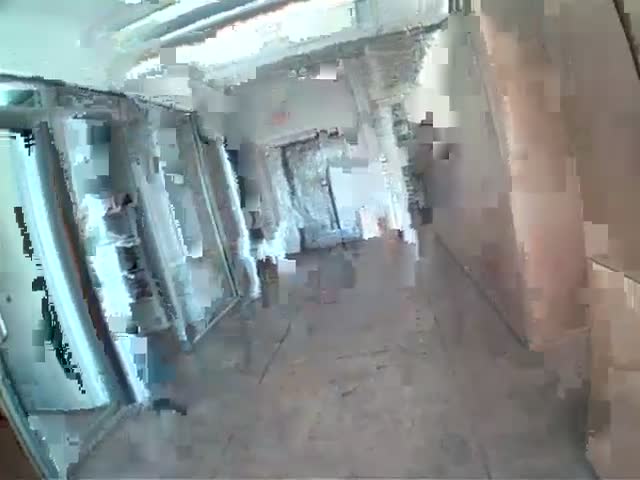
At what (x,y) coordinates should I click in order to perform the action: click on white empty wall. Please return your answer as a coordinate pair (x, y). The height and width of the screenshot is (480, 640). Looking at the image, I should click on (317, 88).